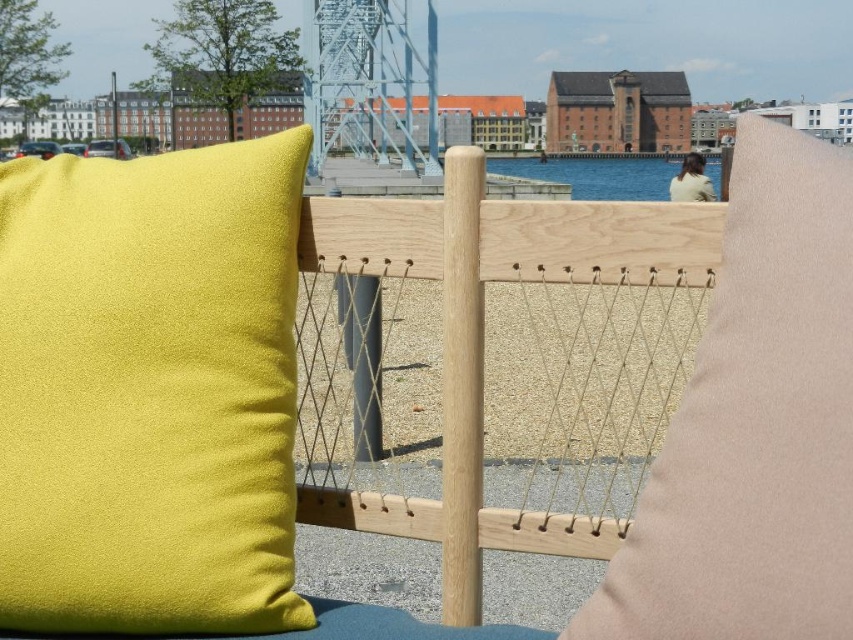
You are designing a layout for a waterfront seating area and need to ensure that the lime green fabric pillow at left and blue water at center are visible from a central viewing point. Given their sizes, which object might require adjustment to ensure proper visibility?

The lime green fabric pillow at left has a lesser width compared to the blue water at center, so it might need to be moved closer or enlarged to ensure proper visibility from the central viewing point.

You are standing in the waterfront area and want to take a photo of the natural wood fence at center and the blue water at center. Based on their positions, which object should you frame first in your camera viewfinder to ensure both are captured in the same shot?

You should frame the natural wood fence at center first since it is to the left of the blue water at center, so positioning the fence on the left side of the viewfinder will allow the water to be included on the right.

You are standing in the waterfront area looking at the wooden seating structure. There are two points marked on the structure. The first point is at coordinates point (x=152, y=268) and the second point is at point (x=635, y=179). Which point is closer to you?

Answer: Point (x=152, y=268) is closer to the camera than point (x=635, y=179), so the first point is closer to you.